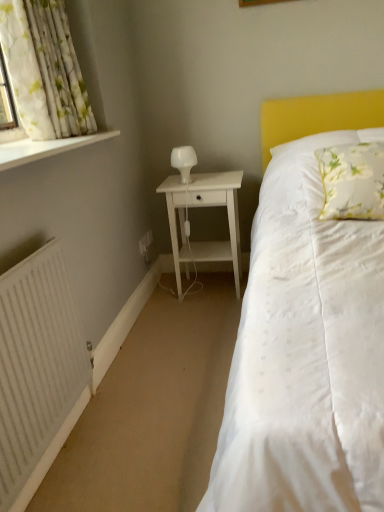
Question: From the image's perspective, is white floral fabric curtain at upper left on top of white matte radiator at lower left?

Choices:
 (A) no
 (B) yes

Answer: (B)

Question: Does white floral fabric curtain at upper left come behind white matte radiator at lower left?

Choices:
 (A) yes
 (B) no

Answer: (A)

Question: Is white floral fabric curtain at upper left to the left of white matte radiator at lower left from the viewer's perspective?

Choices:
 (A) yes
 (B) no

Answer: (A)

Question: Could white matte radiator at lower left be considered to be inside white floral fabric curtain at upper left?

Choices:
 (A) yes
 (B) no

Answer: (B)

Question: From the image's perspective, is white floral fabric curtain at upper left below white matte radiator at lower left?

Choices:
 (A) yes
 (B) no

Answer: (B)

Question: Does white floral fabric curtain at upper left come in front of white matte radiator at lower left?

Choices:
 (A) yes
 (B) no

Answer: (B)

Question: Can you confirm if white matte radiator at lower left is taller than white wood nightstand at center?

Choices:
 (A) no
 (B) yes

Answer: (B)

Question: From a real-world perspective, is white matte radiator at lower left physically above white wood nightstand at center?

Choices:
 (A) no
 (B) yes

Answer: (B)

Question: Is white wood nightstand at center located within white matte radiator at lower left?

Choices:
 (A) yes
 (B) no

Answer: (B)

Question: Is white matte radiator at lower left shorter than white wood nightstand at center?

Choices:
 (A) no
 (B) yes

Answer: (A)

Question: Is white matte radiator at lower left positioned with its back to white wood nightstand at center?

Choices:
 (A) yes
 (B) no

Answer: (B)

Question: From the image's perspective, is white matte radiator at lower left on top of white wood nightstand at center?

Choices:
 (A) no
 (B) yes

Answer: (A)

Question: From a real-world perspective, is white glossy table lamp at center physically above white painted wood at left?

Choices:
 (A) yes
 (B) no

Answer: (B)